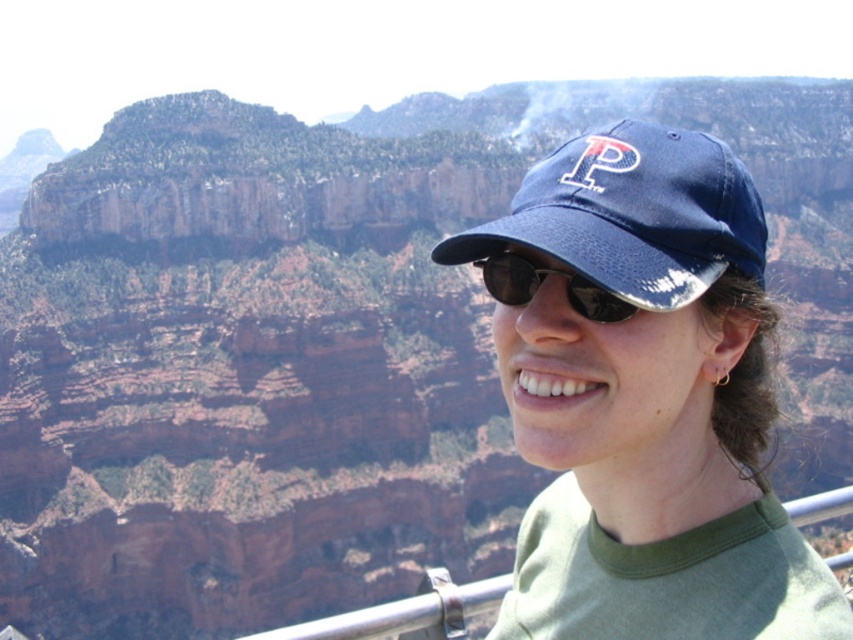
You are a photographer taking a portrait of the person at the scenic overlook. You notice the blue fabric cap at center and the sunglasses at center. Which object should you adjust if you want to ensure both items are clearly visible in the photo?

The blue fabric cap at center has a larger size compared to sunglasses at center. To ensure both items are clearly visible, you should adjust the blue fabric cap at center to avoid it blocking the smaller sunglasses at center.

You are a photographer capturing a portrait of the person in the image. The blue fabric cap at center is positioned at coordinates 0.622 on the x and 0.755 on the y axis. To ensure the cap is centered in the frame, where should you adjust the camera focus? Please specify the coordinates in the format x,y.

The blue fabric cap at center is already positioned at the coordinates (643, 397), so to center it in the frame, the camera focus should be adjusted to those exact coordinates, (643, 397).

You are a photographer taking a picture of the person in the scene. You notice two caps in the frame. Which one is positioned to the right of the other? The blue fabric cap at center and the navy blue fabric baseball cap at upper center are both visible. Please specify which one is to the right.

The blue fabric cap at center is positioned to the right of the navy blue fabric baseball cap at upper center.